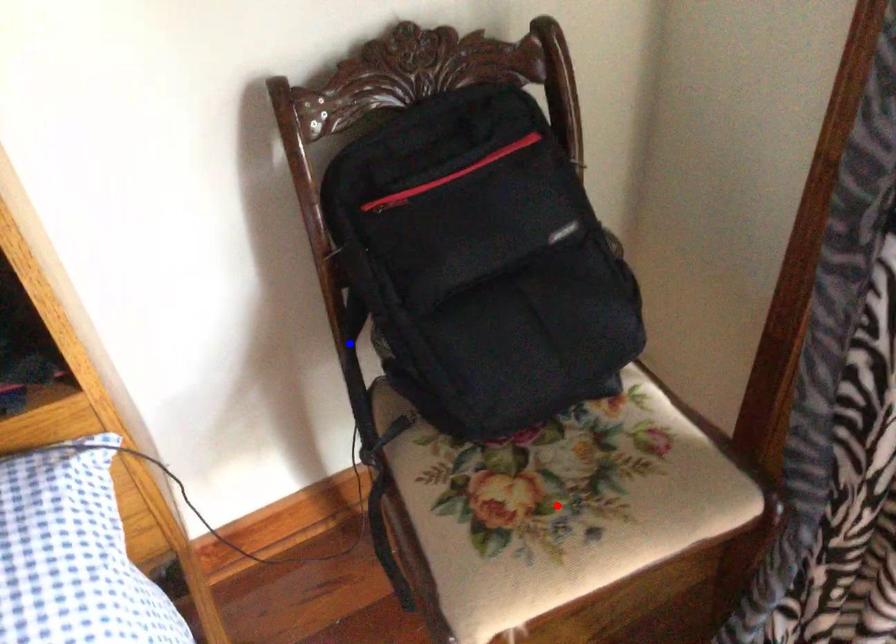
Question: Two points are marked on the image. Which point is closer to the camera?

Choices:
 (A) Blue point is closer.
 (B) Red point is closer.

Answer: (B)